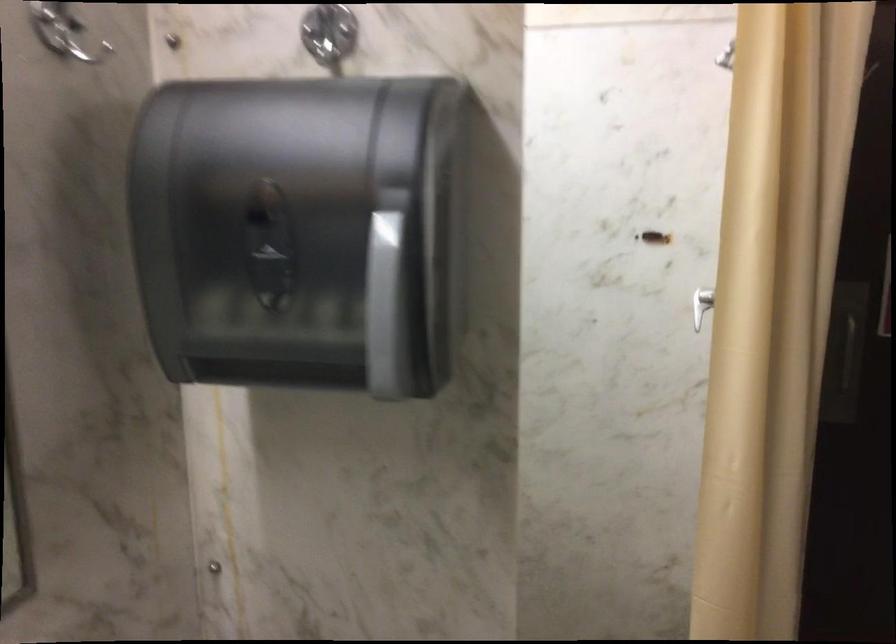
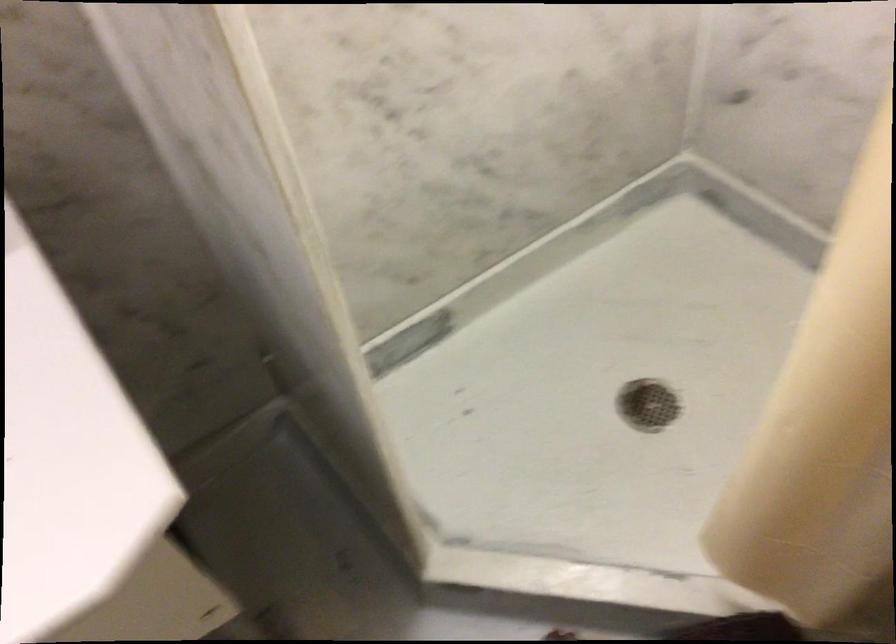
Based on the photo, first-person continuous shooting, in which direction is the camera rotating?

The camera's rotation is toward left-down.